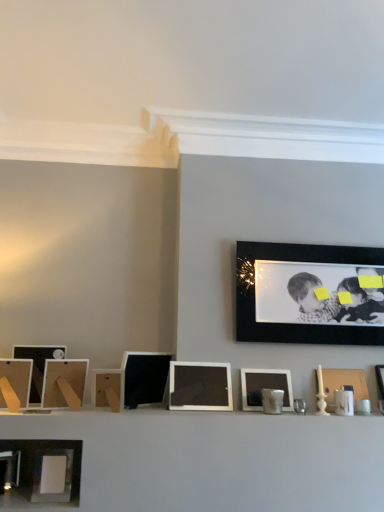
Question: From the image's perspective, does matte wooden picture frame at left, marked as the third picture frame in a left-to-right arrangement, appear higher than matte white picture frame at center, the third picture frame from the right?

Choices:
 (A) yes
 (B) no

Answer: (A)

Question: Is matte white picture frame at center, the 7th picture frame from the left, at the back of matte wooden picture frame at left, marked as the third picture frame in a left-to-right arrangement?

Choices:
 (A) no
 (B) yes

Answer: (A)

Question: Considering the relative sizes of matte wooden picture frame at left, marked as the third picture frame in a left-to-right arrangement, and matte white picture frame at center, the 7th picture frame from the left, in the image provided, is matte wooden picture frame at left, marked as the third picture frame in a left-to-right arrangement, smaller than matte white picture frame at center, the 7th picture frame from the left,?

Choices:
 (A) yes
 (B) no

Answer: (B)

Question: Can you confirm if matte wooden picture frame at left, marked as the third picture frame in a left-to-right arrangement, is thinner than matte white picture frame at center, the 7th picture frame from the left?

Choices:
 (A) yes
 (B) no

Answer: (B)

Question: Can you confirm if matte wooden picture frame at left, marked as the third picture frame in a left-to-right arrangement, is shorter than matte white picture frame at center, the third picture frame from the right?

Choices:
 (A) no
 (B) yes

Answer: (A)

Question: Based on their positions, is wooden at center, which is the 4th picture frame from left to right, located to the left or right of matte black picture frame at left, which is the 9th picture frame from right to left?

Choices:
 (A) right
 (B) left

Answer: (A)

Question: From their relative heights in the image, would you say wooden at center, which is the 4th picture frame from left to right, is taller or shorter than matte black picture frame at left, positioned as the first picture frame in left-to-right order?

Choices:
 (A) short
 (B) tall

Answer: (A)

Question: Considering the positions of wooden at center, which is the 4th picture frame from left to right, and matte black picture frame at left, positioned as the first picture frame in left-to-right order, in the image, is wooden at center, which is the 4th picture frame from left to right, wider or thinner than matte black picture frame at left, positioned as the first picture frame in left-to-right order,?

Choices:
 (A) thin
 (B) wide

Answer: (A)

Question: Does point [119, 390] appear closer or farther from the camera than point [29, 394]?

Choices:
 (A) farther
 (B) closer

Answer: (B)

Question: Considering the relative positions of matte wooden picture frame at left, which is the 7th picture frame from right to left, and wooden at center, which is the 4th picture frame from left to right, in the image provided, is matte wooden picture frame at left, which is the 7th picture frame from right to left, to the left or to the right of wooden at center, which is the 4th picture frame from left to right,?

Choices:
 (A) left
 (B) right

Answer: (A)

Question: Based on their sizes in the image, would you say matte wooden picture frame at left, which is the 7th picture frame from right to left, is bigger or smaller than wooden at center, which is the 4th picture frame from left to right?

Choices:
 (A) big
 (B) small

Answer: (A)

Question: Looking at their shapes, would you say matte wooden picture frame at left, marked as the third picture frame in a left-to-right arrangement, is wider or thinner than wooden at center, arranged as the sixth picture frame when viewed from the right?

Choices:
 (A) wide
 (B) thin

Answer: (A)

Question: Does point (81, 391) appear closer or farther from the camera than point (112, 404)?

Choices:
 (A) farther
 (B) closer

Answer: (A)

Question: Looking at the image, does matte white picture frame at center, the third picture frame from the right, seem bigger or smaller compared to matte black picture frame at left, which is the 9th picture frame from right to left?

Choices:
 (A) small
 (B) big

Answer: (A)

Question: Is matte white picture frame at center, the third picture frame from the right, in front of or behind matte black picture frame at left, which is the 9th picture frame from right to left, in the image?

Choices:
 (A) front
 (B) behind

Answer: (B)